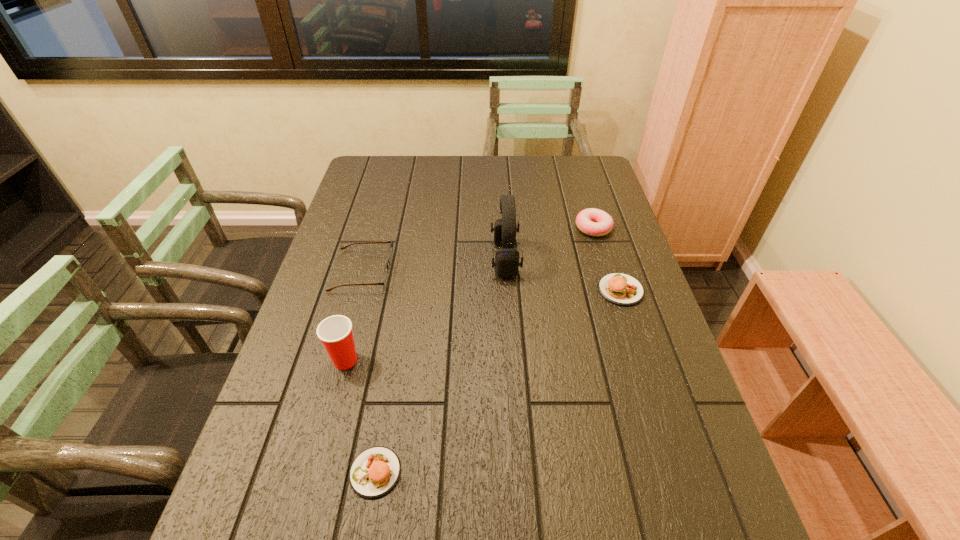
Identify the location of vacant region between the right patty and the doughnut. The height and width of the screenshot is (540, 960). (607, 259).

The width and height of the screenshot is (960, 540). Find the location of `the closest object to the doughnut`. the closest object to the doughnut is located at coordinates (618, 288).

Select which object is the second closest to the shortest object. Please provide its 2D coordinates. Your answer should be formatted as a tuple, i.e. [(x, y)], where the tuple contains the x and y coordinates of a point satisfying the conditions above.

[(390, 253)]

At what (x,y) coordinates should I click in order to perform the action: click on vacant region that satisfies the following two spatial constraints: 1. on the front-facing side of the spectacles; 2. on the back side of the second nearest object. Please return your answer as a coordinate pair (x, y). This screenshot has height=540, width=960. Looking at the image, I should click on (337, 360).

Locate an element on the screen. This screenshot has width=960, height=540. free space that satisfies the following two spatial constraints: 1. on the front side of the farther patty; 2. on the right side of the doughnut is located at coordinates (612, 290).

Locate an element on the screen. free space that satisfies the following two spatial constraints: 1. on the front-facing side of the spectacles; 2. on the back side of the shorter patty is located at coordinates (305, 472).

The width and height of the screenshot is (960, 540). In order to click on vacant space that satisfies the following two spatial constraints: 1. on the front-facing side of the spectacles; 2. on the back side of the second tallest object in this screenshot , I will do `click(337, 360)`.